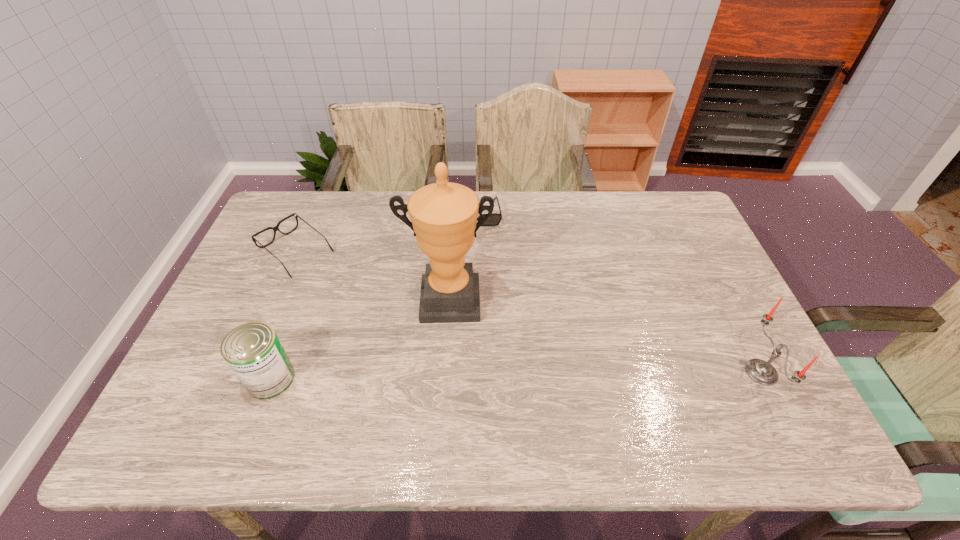
The height and width of the screenshot is (540, 960). Find the location of `spectacles located in the far edge section of the desktop`. spectacles located in the far edge section of the desktop is located at coordinates (276, 228).

Identify the location of can present at the near edge. The width and height of the screenshot is (960, 540). (253, 351).

Find the location of a particular element. candle located at the near edge is located at coordinates (762, 372).

Where is `can that is at the left edge`? can that is at the left edge is located at coordinates (253, 351).

Where is `spectacles that is at the left edge`? The width and height of the screenshot is (960, 540). spectacles that is at the left edge is located at coordinates (276, 228).

Find the location of a particular element. The height and width of the screenshot is (540, 960). object that is positioned at the right edge is located at coordinates (762, 372).

Where is `object that is at the far left corner`? The width and height of the screenshot is (960, 540). object that is at the far left corner is located at coordinates (276, 228).

Locate an element on the screen. object at the near left corner is located at coordinates [x=253, y=351].

Where is `object present at the near right corner`? The height and width of the screenshot is (540, 960). object present at the near right corner is located at coordinates (762, 372).

Locate an element on the screen. vacant area at the far edge is located at coordinates click(626, 219).